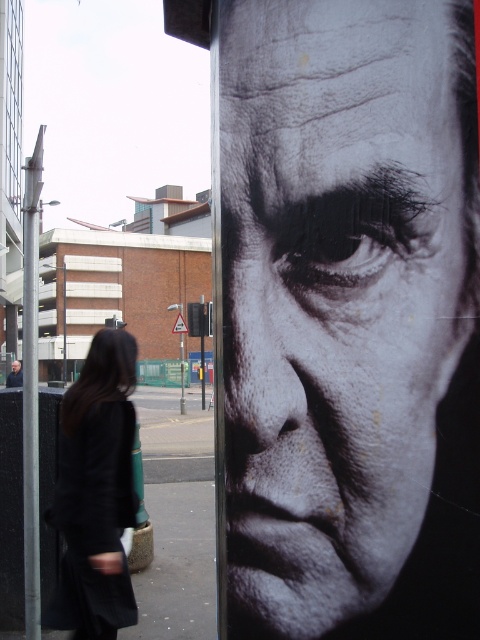
You are a photographer who wants to ensure that both the black matte face at center and the black fabric coat at lower left are clearly visible in a new photo. Given that the camera can only focus on objects within a 1.2 meter width, will both objects fit within this focus range?

The black matte face at center is larger in width than the black fabric coat at lower left. Since the camera can focus on objects within a 1.2 meter width, both objects can fit within this range as long as their combined width does not exceed 1.2 meters. However, the exact fit depends on their individual widths and positioning in the scene.

You are a photographer who wants to capture a portrait of both the black matte face at center and the smooth skin face at center in the same frame. Given their sizes, which one would appear larger in the final photo?

The black matte face at center would appear larger in the final photo because it is taller than the smooth skin face at center.

You are a photographer who wants to capture a clear photo of both the black matte face at center and the black fabric coat at lower left. Since the portrait is in focus, but the coat is slightly blurry, how should you adjust your camera focus to ensure both are clear?

The black matte face at center is located above the black fabric coat at lower left. To capture both clearly, adjust the focus plane to include both the upper and lower areas where these objects are positioned, ensuring the depth of field covers their vertical separation.